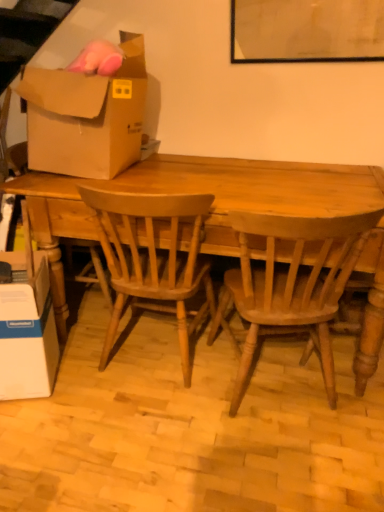
What are the coordinates of `brown cardboard box at upper left, placed as the 1th box when sorted from top to bottom` in the screenshot? It's located at (86, 116).

The image size is (384, 512). Identify the location of light brown wood chair at center, which is counted as the 2th chair, starting from the right. (153, 256).

At what (x,y) coordinates should I click in order to perform the action: click on brown cardboard box at upper left, placed as the 1th box when sorted from top to bottom. Please return your answer as a coordinate pair (x, y). The height and width of the screenshot is (512, 384). Looking at the image, I should click on (86, 116).

Can you tell me how much white cardboard box at lower left, arranged as the 1th box when ordered from the bottom, and light brown wood chair at center, the second chair when ordered from left to right, differ in facing direction?

They differ by 178 degrees in their facing directions.

Considering the relative sizes of white cardboard box at lower left, arranged as the 1th box when ordered from the bottom, and light brown wood chair at center, the second chair when ordered from left to right, in the image provided, is white cardboard box at lower left, arranged as the 1th box when ordered from the bottom, shorter than light brown wood chair at center, the second chair when ordered from left to right,?

Correct, white cardboard box at lower left, arranged as the 1th box when ordered from the bottom, is not as tall as light brown wood chair at center, the second chair when ordered from left to right.

Considering their positions, is white cardboard box at lower left, positioned as the 2th box in top-to-bottom order, located in front of or behind light brown wood chair at center, the second chair when ordered from left to right?

Visually, white cardboard box at lower left, positioned as the 2th box in top-to-bottom order, is located behind light brown wood chair at center, the second chair when ordered from left to right.

Is the surface of white cardboard box at lower left, arranged as the 1th box when ordered from the bottom, in direct contact with light brown wood chair at center, the second chair when ordered from left to right?

No, white cardboard box at lower left, arranged as the 1th box when ordered from the bottom, is not next to light brown wood chair at center, the second chair when ordered from left to right.

Consider the image. Which of these two, brown cardboard box at upper left, placed as the 2th box when sorted from bottom to top, or light brown wood chair at center, acting as the first chair starting from the left, is bigger?

With larger size is light brown wood chair at center, acting as the first chair starting from the left.

In terms of height, does brown cardboard box at upper left, placed as the 2th box when sorted from bottom to top, look taller or shorter compared to light brown wood chair at center, acting as the first chair starting from the left?

In the image, brown cardboard box at upper left, placed as the 2th box when sorted from bottom to top, appears to be shorter than light brown wood chair at center, acting as the first chair starting from the left.

Would you say brown cardboard box at upper left, placed as the 2th box when sorted from bottom to top, is to the left or to the right of light brown wood chair at center, acting as the first chair starting from the left, in the picture?

brown cardboard box at upper left, placed as the 2th box when sorted from bottom to top, is positioned on light brown wood chair at center, acting as the first chair starting from the left,'s left side.

From the image's perspective, is brown cardboard box at upper left, placed as the 1th box when sorted from top to bottom, located above light brown wood chair at center, acting as the first chair starting from the left?

Yes.

Which object is further away from the camera, wooden table at center or white cardboard box at lower left, positioned as the 2th box in top-to-bottom order?

white cardboard box at lower left, positioned as the 2th box in top-to-bottom order, is more distant.

How far apart are wooden table at center and white cardboard box at lower left, arranged as the 1th box when ordered from the bottom?

wooden table at center is 55.65 centimeters from white cardboard box at lower left, arranged as the 1th box when ordered from the bottom.

From a real-world perspective, is wooden table at center on top of white cardboard box at lower left, positioned as the 2th box in top-to-bottom order?

Yes, from a real-world perspective, wooden table at center is on top of white cardboard box at lower left, positioned as the 2th box in top-to-bottom order.

Would you say wooden table at center is a long distance from white cardboard box at lower left, positioned as the 2th box in top-to-bottom order?

No, wooden table at center is not far from white cardboard box at lower left, positioned as the 2th box in top-to-bottom order.

Could you measure the distance between wooden table at center and brown cardboard box at upper left, placed as the 1th box when sorted from top to bottom?

40.54 centimeters.

Which of these two, wooden table at center or brown cardboard box at upper left, placed as the 2th box when sorted from bottom to top, stands shorter?

brown cardboard box at upper left, placed as the 2th box when sorted from bottom to top.

Is wooden table at center positioned beyond the bounds of brown cardboard box at upper left, placed as the 1th box when sorted from top to bottom?

Yes.

Is wooden table at center looking in the opposite direction of brown cardboard box at upper left, placed as the 1th box when sorted from top to bottom?

wooden table at center is not turned away from brown cardboard box at upper left, placed as the 1th box when sorted from top to bottom.

Could you measure the distance between light brown wood chair at center, arranged as the 1th chair when viewed from the right, and wooden table at center?

A distance of 11.96 inches exists between light brown wood chair at center, arranged as the 1th chair when viewed from the right, and wooden table at center.

Which is more to the right, light brown wood chair at center, the second chair when ordered from left to right, or wooden table at center?

From the viewer's perspective, light brown wood chair at center, the second chair when ordered from left to right, appears more on the right side.

From a real-world perspective, relative to wooden table at center, is light brown wood chair at center, arranged as the 1th chair when viewed from the right, vertically above or below?

Clearly, from a real-world perspective, light brown wood chair at center, arranged as the 1th chair when viewed from the right, is above wooden table at center.

Considering the sizes of objects light brown wood chair at center, the second chair when ordered from left to right, and wooden table at center in the image provided, who is wider, light brown wood chair at center, the second chair when ordered from left to right, or wooden table at center?

wooden table at center.

Looking at this image, from a real-world perspective, is light brown wood chair at center, which is counted as the 2th chair, starting from the right, above or below wooden table at center?

From a real-world perspective, light brown wood chair at center, which is counted as the 2th chair, starting from the right, is physically above wooden table at center.

Could you tell me if light brown wood chair at center, acting as the first chair starting from the left, is turned towards wooden table at center?

Yes, light brown wood chair at center, acting as the first chair starting from the left, is facing wooden table at center.

Is light brown wood chair at center, which is counted as the 2th chair, starting from the right, thinner than wooden table at center?

Yes.

Considering the points (105, 234) and (281, 212), which point is in front, point (105, 234) or point (281, 212)?

The point (281, 212) is more forward.

Between white cardboard box at lower left, arranged as the 1th box when ordered from the bottom, and brown cardboard box at upper left, placed as the 1th box when sorted from top to bottom, which one has more height?

brown cardboard box at upper left, placed as the 1th box when sorted from top to bottom.

From a real-world perspective, between white cardboard box at lower left, positioned as the 2th box in top-to-bottom order, and brown cardboard box at upper left, placed as the 2th box when sorted from bottom to top, who is vertically higher?

brown cardboard box at upper left, placed as the 2th box when sorted from bottom to top.

You are a GUI agent. You are given a task and a screenshot of the screen. Output one action in this format:
    pyautogui.click(x=<x>, y=<y>)
    Task: Click on the box above the white cardboard box at lower left, arranged as the 1th box when ordered from the bottom (from the image's perspective)
    This screenshot has width=384, height=512.
    Given the screenshot: What is the action you would take?
    pyautogui.click(x=86, y=116)

Is white cardboard box at lower left, positioned as the 2th box in top-to-bottom order, far from brown cardboard box at upper left, placed as the 1th box when sorted from top to bottom?

No, white cardboard box at lower left, positioned as the 2th box in top-to-bottom order, is not far away from brown cardboard box at upper left, placed as the 1th box when sorted from top to bottom.

Locate an element on the screen. the 1st chair positioned above the white cardboard box at lower left, arranged as the 1th box when ordered from the bottom (from the image's perspective) is located at coordinates (292, 282).

There is a brown cardboard box at upper left, placed as the 1th box when sorted from top to bottom. Where is `the 1st chair below it (from the image's perspective)`? The height and width of the screenshot is (512, 384). the 1st chair below it (from the image's perspective) is located at coordinates [x=153, y=256].

From the image, which object appears to be farther from light brown wood chair at center, acting as the first chair starting from the left, white cardboard box at lower left, positioned as the 2th box in top-to-bottom order, or wooden table at center?

A: white cardboard box at lower left, positioned as the 2th box in top-to-bottom order, is further to light brown wood chair at center, acting as the first chair starting from the left.

From the image, which object appears to be farther from wooden table at center, brown cardboard box at upper left, placed as the 1th box when sorted from top to bottom, or light brown wood chair at center, which is counted as the 2th chair, starting from the right?

brown cardboard box at upper left, placed as the 1th box when sorted from top to bottom, is further to wooden table at center.

From the image, which object appears to be farther from brown cardboard box at upper left, placed as the 1th box when sorted from top to bottom, light brown wood chair at center, the second chair when ordered from left to right, or light brown wood chair at center, which is counted as the 2th chair, starting from the right?

light brown wood chair at center, the second chair when ordered from left to right, is further to brown cardboard box at upper left, placed as the 1th box when sorted from top to bottom.

From the image, which object appears to be nearer to light brown wood chair at center, which is counted as the 2th chair, starting from the right, brown cardboard box at upper left, placed as the 1th box when sorted from top to bottom, or white cardboard box at lower left, arranged as the 1th box when ordered from the bottom?

white cardboard box at lower left, arranged as the 1th box when ordered from the bottom, is positioned closer to the anchor light brown wood chair at center, which is counted as the 2th chair, starting from the right.

Which object lies further to the anchor point brown cardboard box at upper left, placed as the 2th box when sorted from bottom to top, light brown wood chair at center, the second chair when ordered from left to right, or white cardboard box at lower left, positioned as the 2th box in top-to-bottom order?

Based on the image, light brown wood chair at center, the second chair when ordered from left to right, appears to be further to brown cardboard box at upper left, placed as the 2th box when sorted from bottom to top.

Looking at this image, considering their positions, is white cardboard box at lower left, positioned as the 2th box in top-to-bottom order, positioned further to light brown wood chair at center, arranged as the 1th chair when viewed from the right, than wooden table at center?

white cardboard box at lower left, positioned as the 2th box in top-to-bottom order, is further to light brown wood chair at center, arranged as the 1th chair when viewed from the right.

When comparing their distances from white cardboard box at lower left, arranged as the 1th box when ordered from the bottom, does wooden table at center or light brown wood chair at center, arranged as the 1th chair when viewed from the right, seem further?

The object further to white cardboard box at lower left, arranged as the 1th box when ordered from the bottom, is light brown wood chair at center, arranged as the 1th chair when viewed from the right.

Considering their positions, is brown cardboard box at upper left, placed as the 2th box when sorted from bottom to top, positioned further to white cardboard box at lower left, arranged as the 1th box when ordered from the bottom, than light brown wood chair at center, acting as the first chair starting from the left?

brown cardboard box at upper left, placed as the 2th box when sorted from bottom to top, is positioned further to the anchor white cardboard box at lower left, arranged as the 1th box when ordered from the bottom.

Identify the location of box between white cardboard box at lower left, arranged as the 1th box when ordered from the bottom, and light brown wood chair at center, arranged as the 1th chair when viewed from the right. The height and width of the screenshot is (512, 384). (86, 116).

Image resolution: width=384 pixels, height=512 pixels. I want to click on chair between brown cardboard box at upper left, placed as the 1th box when sorted from top to bottom, and light brown wood chair at center, the second chair when ordered from left to right, vertically, so click(153, 256).

This screenshot has height=512, width=384. Identify the location of desk between brown cardboard box at upper left, placed as the 1th box when sorted from top to bottom, and white cardboard box at lower left, positioned as the 2th box in top-to-bottom order, in the up-down direction. (198, 192).

Find the location of a particular element. Image resolution: width=384 pixels, height=512 pixels. desk that lies between brown cardboard box at upper left, placed as the 1th box when sorted from top to bottom, and light brown wood chair at center, acting as the first chair starting from the left, from top to bottom is located at coordinates (198, 192).